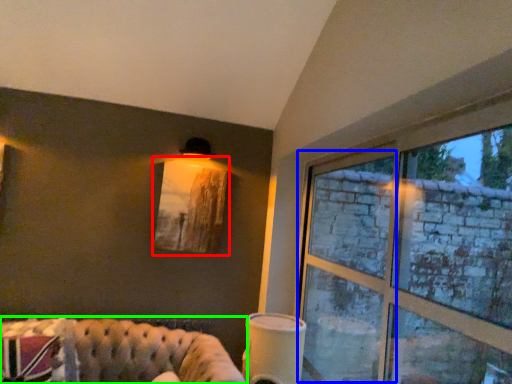
Question: Estimate the real-world distances between objects in this image. Which object is closer to picture frame (highlighted by a red box), window frame (highlighted by a blue box) or studio couch (highlighted by a green box)?

Choices:
 (A) window frame
 (B) studio couch

Answer: (B)